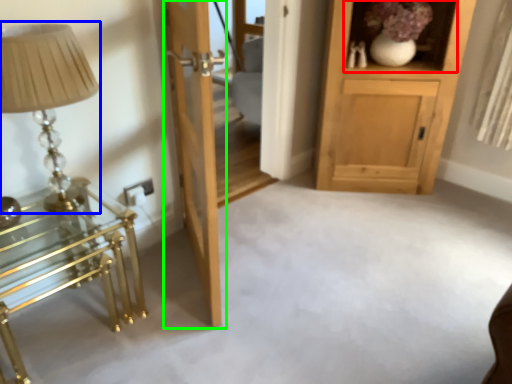
Question: Which is farther away from shelf (highlighted by a red box)? table lamp (highlighted by a blue box) or door (highlighted by a green box)?

Choices:
 (A) table lamp
 (B) door

Answer: (A)